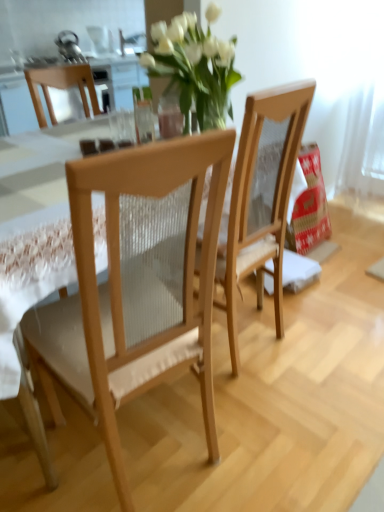
Question: Can we say light wood mesh chair at center, the first chair viewed from the left, lies outside natural wood chair at center, marked as the 1th chair in a right-to-left arrangement?

Choices:
 (A) no
 (B) yes

Answer: (B)

Question: Is the depth of light wood mesh chair at center, the first chair viewed from the left, less than that of natural wood chair at center, marked as the 1th chair in a right-to-left arrangement?

Choices:
 (A) no
 (B) yes

Answer: (B)

Question: Is light wood mesh chair at center, the first chair viewed from the left, to the left of natural wood chair at center, the 2th chair in the left-to-right sequence, from the viewer's perspective?

Choices:
 (A) yes
 (B) no

Answer: (A)

Question: From the image's perspective, is light wood mesh chair at center, the first chair viewed from the left, below natural wood chair at center, the 2th chair in the left-to-right sequence?

Choices:
 (A) yes
 (B) no

Answer: (A)

Question: From a real-world perspective, is light wood mesh chair at center, the second chair viewed from the right, physically below natural wood chair at center, marked as the 1th chair in a right-to-left arrangement?

Choices:
 (A) yes
 (B) no

Answer: (A)

Question: Is light wood mesh chair at center, the first chair viewed from the left, aimed at natural wood chair at center, marked as the 1th chair in a right-to-left arrangement?

Choices:
 (A) no
 (B) yes

Answer: (A)

Question: Does natural wood chair at center, marked as the 1th chair in a right-to-left arrangement, have a greater height compared to light wood mesh chair at center, the first chair viewed from the left?

Choices:
 (A) no
 (B) yes

Answer: (B)

Question: Is natural wood chair at center, the 2th chair in the left-to-right sequence, oriented towards light wood mesh chair at center, the first chair viewed from the left?

Choices:
 (A) yes
 (B) no

Answer: (B)

Question: Does natural wood chair at center, marked as the 1th chair in a right-to-left arrangement, have a lesser width compared to light wood mesh chair at center, the first chair viewed from the left?

Choices:
 (A) yes
 (B) no

Answer: (A)

Question: Is natural wood chair at center, marked as the 1th chair in a right-to-left arrangement, bigger than light wood mesh chair at center, the first chair viewed from the left?

Choices:
 (A) yes
 (B) no

Answer: (B)

Question: Would you say light wood mesh chair at center, the second chair viewed from the right, is part of natural wood chair at center, marked as the 1th chair in a right-to-left arrangement,'s contents?

Choices:
 (A) yes
 (B) no

Answer: (B)

Question: Considering the relative positions of natural wood chair at center, marked as the 1th chair in a right-to-left arrangement, and light wood mesh chair at center, the first chair viewed from the left, in the image provided, is natural wood chair at center, marked as the 1th chair in a right-to-left arrangement, in front of light wood mesh chair at center, the first chair viewed from the left,?

Choices:
 (A) yes
 (B) no

Answer: (B)

Question: Visually, is light wood mesh chair at center, the first chair viewed from the left, positioned to the left or to the right of natural wood chair at center, marked as the 1th chair in a right-to-left arrangement?

Choices:
 (A) left
 (B) right

Answer: (A)